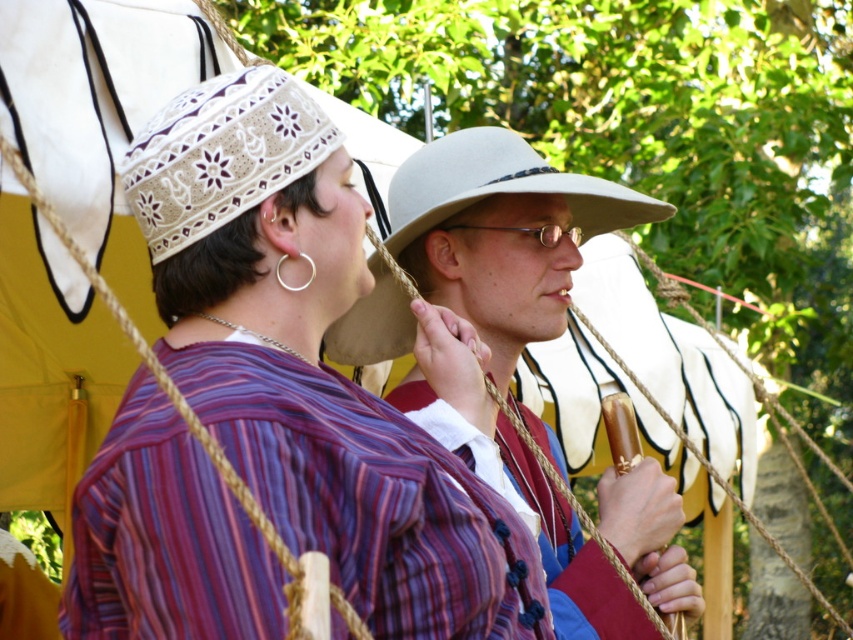
You are an event organizer planning a historical reenactment. You need to ensure that the matte striped shirt at center and the white lace cowboy hat at upper center are visible to the audience. Given their sizes, which object should be placed higher to ensure visibility?

The white lace cowboy hat at upper center should be placed higher because it is smaller in size compared to the matte striped shirt at center, allowing it to be positioned where it can be seen without being obscured by the larger object.